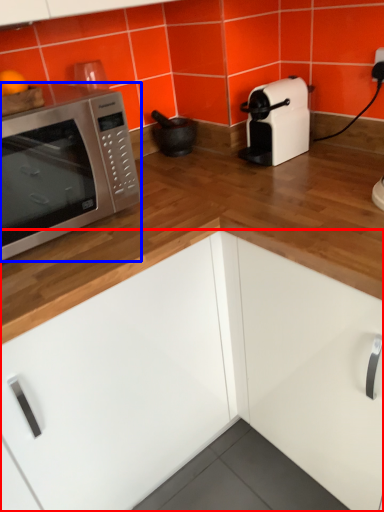
Question: Which object is closer to the camera taking this photo, cabinetry (highlighted by a red box) or microwave oven (highlighted by a blue box)?

Choices:
 (A) cabinetry
 (B) microwave oven

Answer: (A)